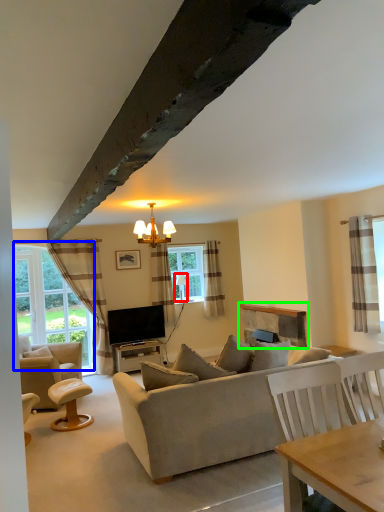
Question: Which is nearer to the lamp (highlighted by a red box)? bay window (highlighted by a blue box) or fireplace (highlighted by a green box).

Choices:
 (A) bay window
 (B) fireplace

Answer: (B)